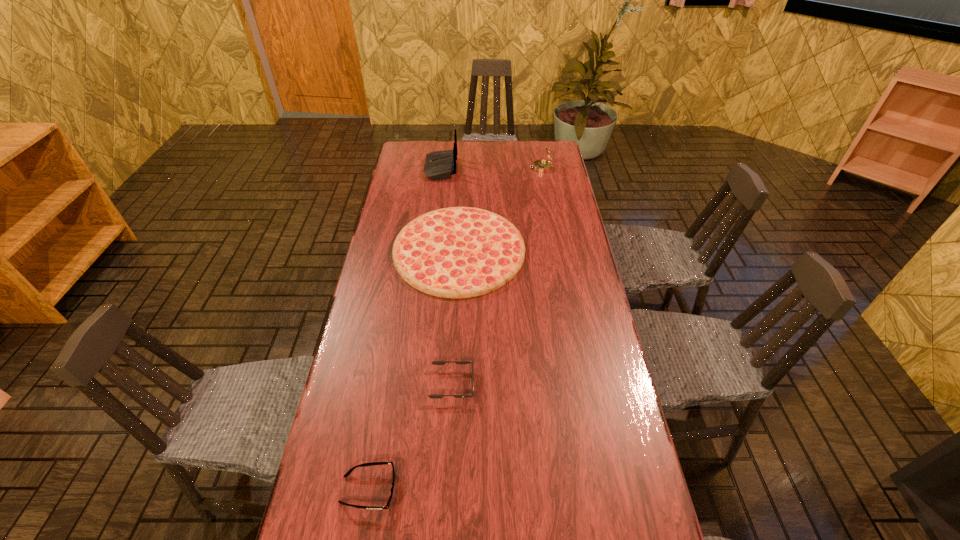
Identify the location of object that is positioned at the right edge. point(542,166).

Locate an element on the screen. This screenshot has width=960, height=540. object present at the far left corner is located at coordinates click(x=439, y=165).

The image size is (960, 540). Find the location of `object present at the far right corner`. object present at the far right corner is located at coordinates (542, 166).

I want to click on free space at the far edge of the desktop, so click(509, 148).

Image resolution: width=960 pixels, height=540 pixels. In the image, there is a desktop. In order to click on vacant space at the left edge in this screenshot , I will do `click(386, 450)`.

This screenshot has height=540, width=960. What are the coordinates of `free region at the right edge` in the screenshot? It's located at (608, 397).

I want to click on vacant space at the far left corner, so [420, 164].

Find the location of `unoccupied area between the pizza and the nearest object`. unoccupied area between the pizza and the nearest object is located at coordinates (414, 370).

Where is `vacant area between the left sunglasses and the rightmost object`? Image resolution: width=960 pixels, height=540 pixels. vacant area between the left sunglasses and the rightmost object is located at coordinates (455, 329).

Find the location of a particular element. free point between the fourth farthest object and the third nearest object is located at coordinates (456, 318).